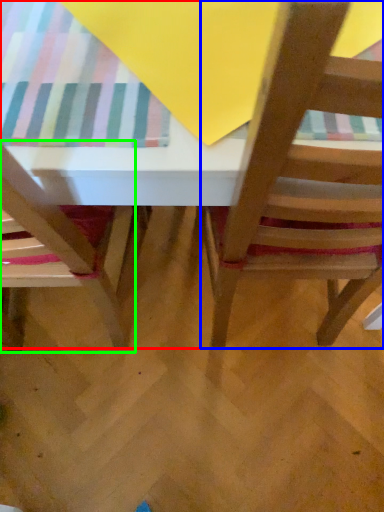
Question: Considering the real-world distances, which object is closest to table (highlighted by a red box)? chair (highlighted by a blue box) or chair (highlighted by a green box).

Choices:
 (A) chair
 (B) chair

Answer: (A)